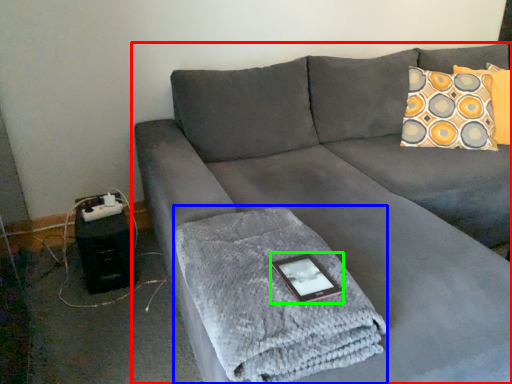
Question: Considering the real-world distances, which object is farthest from studio couch (highlighted by a red box)? bath towel (highlighted by a blue box) or tablet computer (highlighted by a green box)?

Choices:
 (A) bath towel
 (B) tablet computer

Answer: (B)